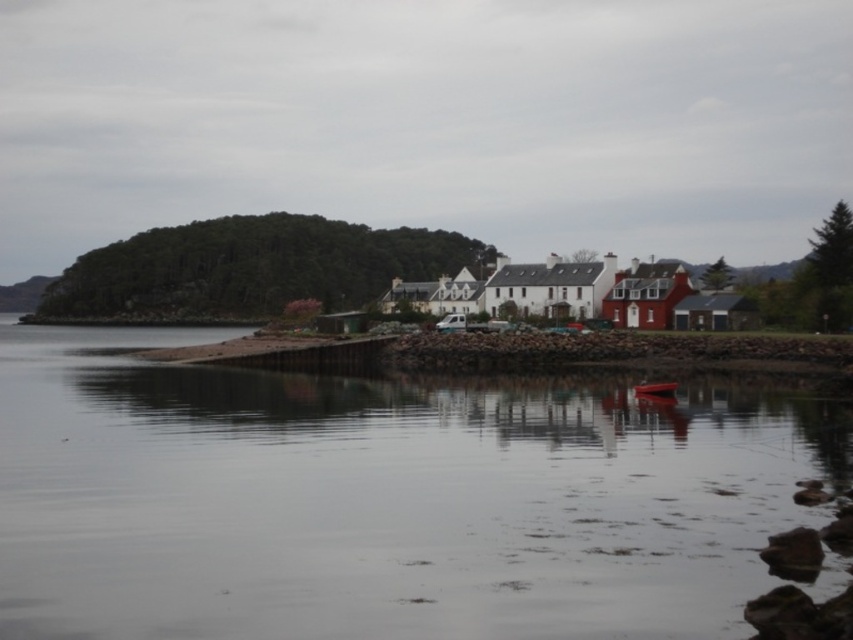
Does smooth water at center appear over green forested island at left?

Incorrect, smooth water at center is not positioned above green forested island at left.

Which is more to the right, smooth water at center or green forested island at left?

smooth water at center

Does point (294, 616) come farther from viewer compared to point (170, 269)?

No.

Find the location of a particular element. Image resolution: width=853 pixels, height=640 pixels. smooth water at center is located at coordinates (384, 497).

In the scene shown: Does smooth water at center have a lesser height compared to metallic red boat at center?

Incorrect, smooth water at center's height does not fall short of metallic red boat at center's.

Who is shorter, smooth water at center or metallic red boat at center?

metallic red boat at center

Is point (451, 602) closer to camera compared to point (639, 388)?

Yes, point (451, 602) is closer to viewer.

Find the location of a particular element. The width and height of the screenshot is (853, 640). smooth water at center is located at coordinates (384, 497).

Who is lower down, green forested island at left or metallic red boat at center?

metallic red boat at center is lower down.

Can you confirm if green forested island at left is bigger than metallic red boat at center?

Yes.

Is point (358, 294) closer to viewer compared to point (635, 387)?

That is False.

The width and height of the screenshot is (853, 640). I want to click on green forested island at left, so click(x=253, y=268).